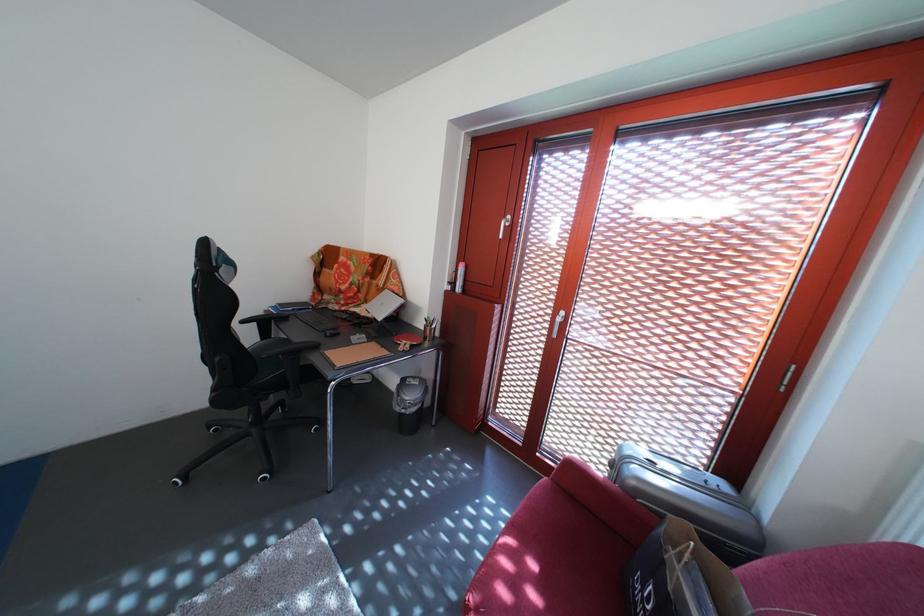
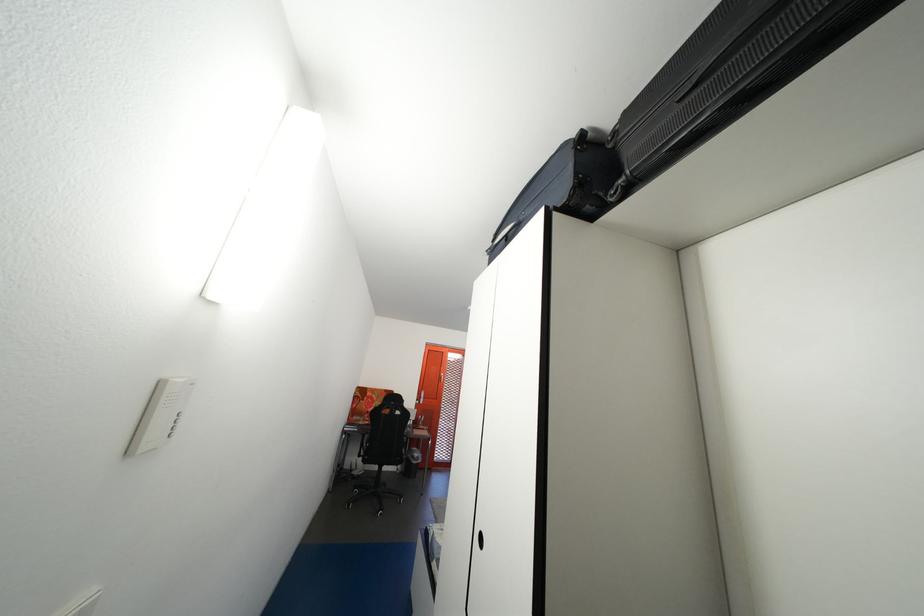
Question: I am providing you with two images of the same scene from different viewpoints. Please identify which objects are invisible in image2.

Choices:
 (A) black chair armrest
 (B) silver suitcase
 (C) green plastic package
 (D) orange door handle

Answer: (B)